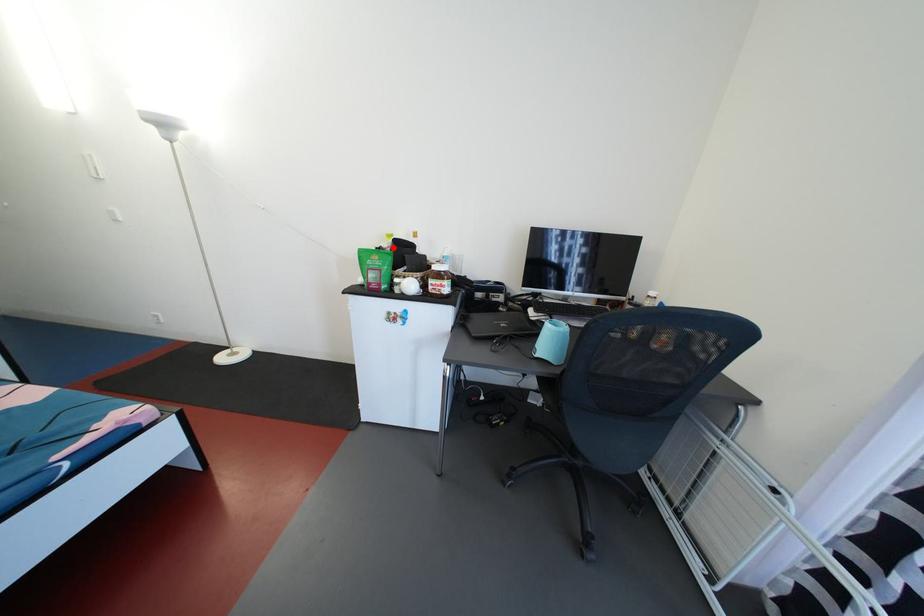
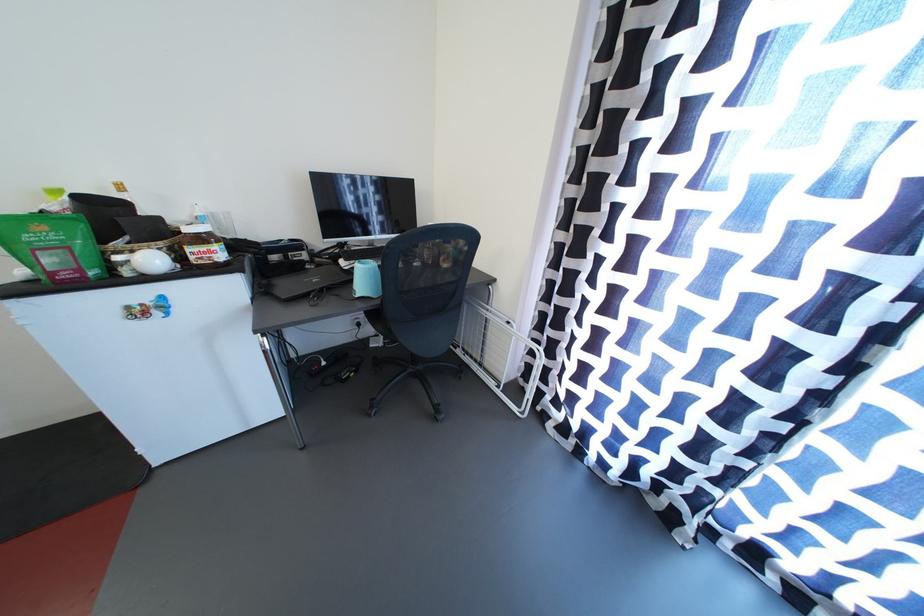
Locate, in the second image, the point that corresponds to the highlighted location in the first image.

(64, 209)